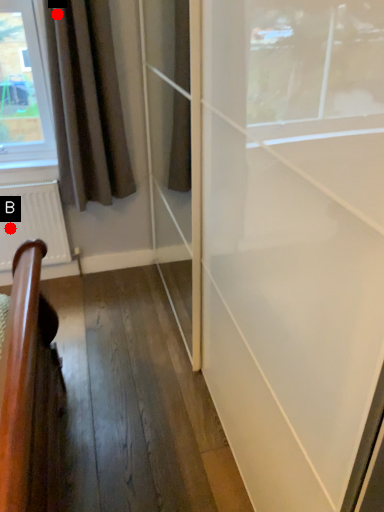
Question: Two points are circled on the image, labeled by A and B beside each circle. Which point is closer to the camera?

Choices:
 (A) A is closer
 (B) B is closer

Answer: (A)